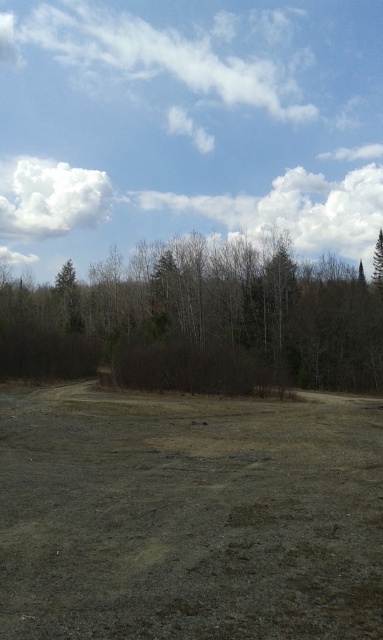
Question: Can you confirm if brown/dry soil at center is bigger than brown/dry bush at center?

Choices:
 (A) yes
 (B) no

Answer: (B)

Question: Among these points, which one is nearest to the camera?

Choices:
 (A) (299, 397)
 (B) (307, 282)

Answer: (A)

Question: Which point is closer to the camera?

Choices:
 (A) (19, 593)
 (B) (261, 336)

Answer: (A)

Question: Can you confirm if brown/dry soil at center is thinner than brown/dry bush at center?

Choices:
 (A) no
 (B) yes

Answer: (B)

Question: Can you confirm if brown/dry soil at center is smaller than brown/dry bush at center?

Choices:
 (A) yes
 (B) no

Answer: (A)